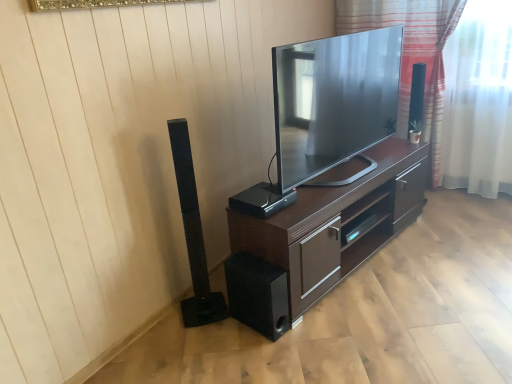
Question: Should I look upward or downward to see striped fabric at upper right?

Choices:
 (A) up
 (B) down

Answer: (A)

Question: Is black matte speaker at lower center, the 2th speaker positioned from the right, positioned beyond the bounds of matte black tv at center?

Choices:
 (A) no
 (B) yes

Answer: (B)

Question: From a real-world perspective, is black matte speaker at lower center, the second speaker when ordered from left to right, located beneath matte black tv at center?

Choices:
 (A) yes
 (B) no

Answer: (A)

Question: Is black matte speaker at lower center, the 2th speaker positioned from the right, to the right of matte black tv at center from the viewer's perspective?

Choices:
 (A) yes
 (B) no

Answer: (B)

Question: Is black matte speaker at lower center, the second speaker when ordered from left to right, at the left side of matte black tv at center?

Choices:
 (A) yes
 (B) no

Answer: (A)

Question: Considering the relative sizes of black matte speaker at lower center, the 2th speaker positioned from the right, and matte black tv at center in the image provided, is black matte speaker at lower center, the 2th speaker positioned from the right, wider than matte black tv at center?

Choices:
 (A) yes
 (B) no

Answer: (A)

Question: Considering the relative sizes of black matte speaker at lower center, the second speaker when ordered from left to right, and matte black tv at center in the image provided, is black matte speaker at lower center, the second speaker when ordered from left to right, taller than matte black tv at center?

Choices:
 (A) no
 (B) yes

Answer: (A)

Question: Does black matte speaker at lower center, the second speaker when ordered from left to right, have a smaller size compared to black plastic speaker at center, which appears as the 3th speaker when viewed from the left?

Choices:
 (A) no
 (B) yes

Answer: (A)

Question: Is black matte speaker at lower center, the second speaker when ordered from left to right, positioned with its back to black plastic speaker at center, which appears as the 3th speaker when viewed from the left?

Choices:
 (A) yes
 (B) no

Answer: (B)

Question: Is black matte speaker at lower center, the second speaker when ordered from left to right, thinner than black plastic speaker at center, the 1th speaker in the right-to-left sequence?

Choices:
 (A) no
 (B) yes

Answer: (A)

Question: Is the depth of black matte speaker at lower center, the 2th speaker positioned from the right, less than that of black plastic speaker at center, which appears as the 3th speaker when viewed from the left?

Choices:
 (A) yes
 (B) no

Answer: (A)

Question: From a real-world perspective, is black matte speaker at lower center, the 2th speaker positioned from the right, physically above black plastic speaker at center, the 1th speaker in the right-to-left sequence?

Choices:
 (A) no
 (B) yes

Answer: (A)

Question: From the image's perspective, is black matte speaker at lower center, the second speaker when ordered from left to right, beneath black plastic speaker at center, the 1th speaker in the right-to-left sequence?

Choices:
 (A) no
 (B) yes

Answer: (B)

Question: From a real-world perspective, is black matte speaker at lower center, the second speaker when ordered from left to right, on striped fabric at upper right?

Choices:
 (A) no
 (B) yes

Answer: (A)